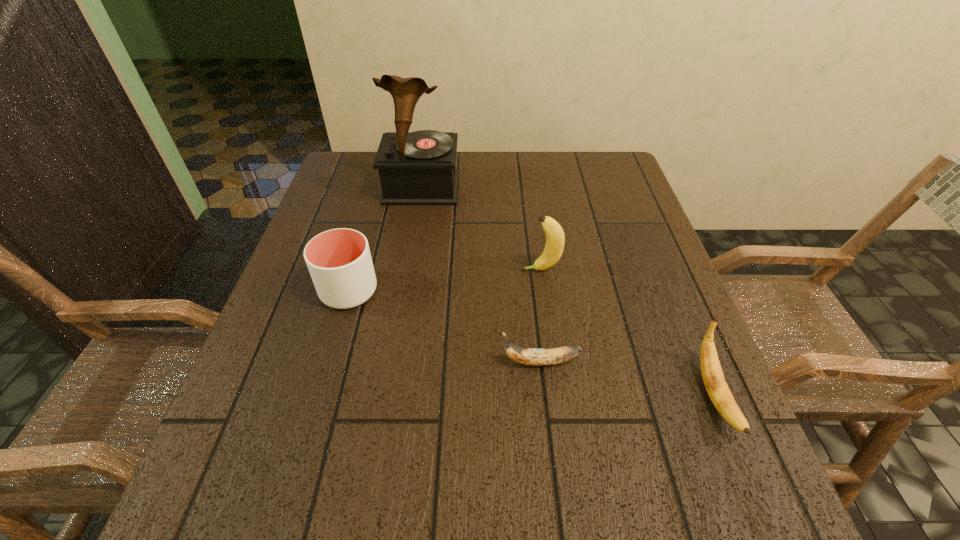
Image resolution: width=960 pixels, height=540 pixels. Find the location of `blank space located 0.230m from the stem of the tallest banana`. blank space located 0.230m from the stem of the tallest banana is located at coordinates (416, 270).

This screenshot has height=540, width=960. Identify the location of vacant area situated 0.050m from the stem of the tallest banana. (498, 270).

At what (x,y) coordinates should I click in order to perform the action: click on vacant space located on the front of the third shortest object. Please return your answer as a coordinate pair (x, y). This screenshot has width=960, height=540. Looking at the image, I should click on (327, 364).

What are the coordinates of `blank area located at the stem of the shortest banana` in the screenshot? It's located at (422, 362).

Where is `vacant space situated at the stem of the shortest banana`? vacant space situated at the stem of the shortest banana is located at coordinates (356, 362).

I want to click on vacant space located at the stem of the shortest banana, so click(384, 362).

I want to click on object that is at the far edge, so click(416, 168).

At what (x,y) coordinates should I click in order to perform the action: click on phonograph_record located in the left edge section of the desktop. Please return your answer as a coordinate pair (x, y). The height and width of the screenshot is (540, 960). Looking at the image, I should click on (416, 168).

Where is `cup that is positioned at the left edge`? The height and width of the screenshot is (540, 960). cup that is positioned at the left edge is located at coordinates (339, 261).

The height and width of the screenshot is (540, 960). What are the coordinates of `object that is at the right edge` in the screenshot? It's located at (713, 377).